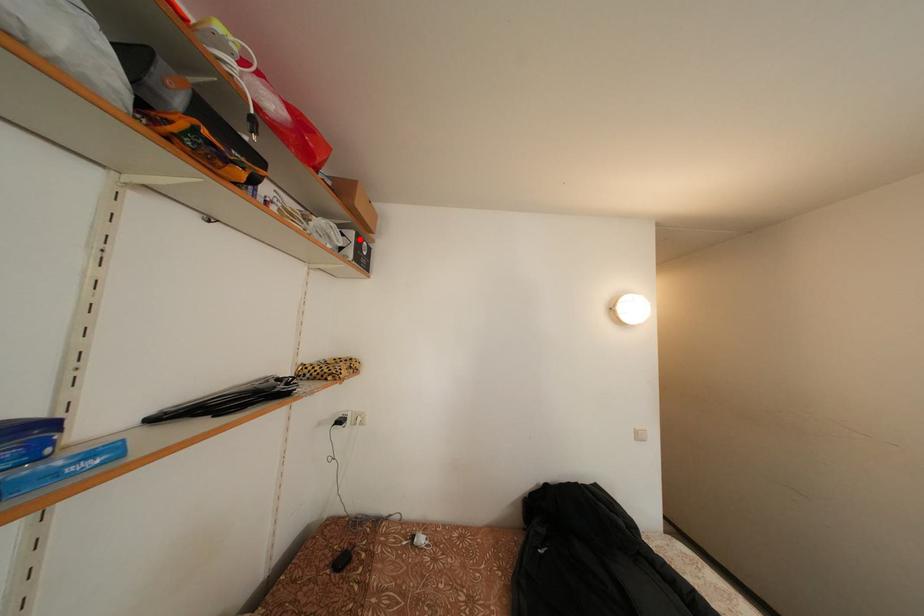
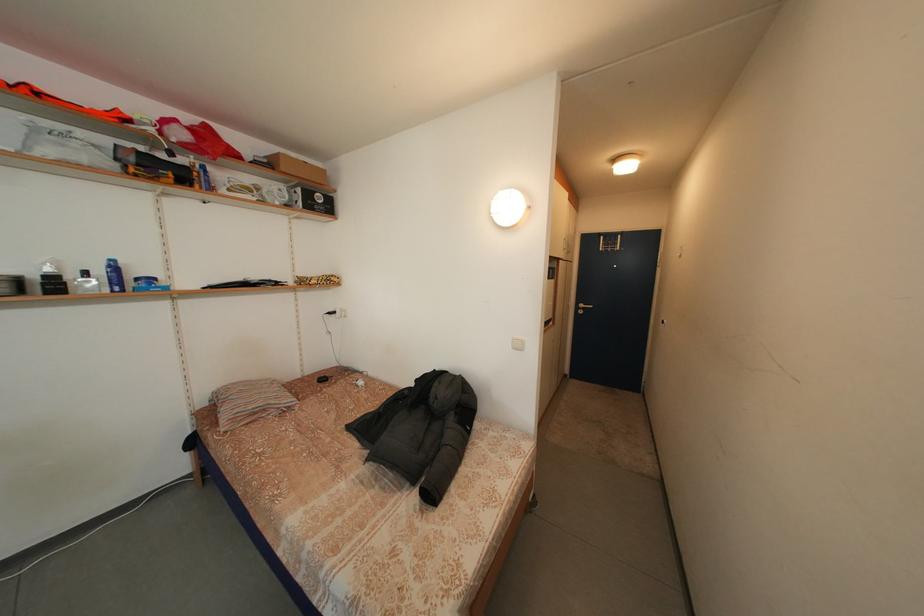
The point at the highlighted location is marked in the first image. Where is the corresponding point in the second image?

(307, 196)